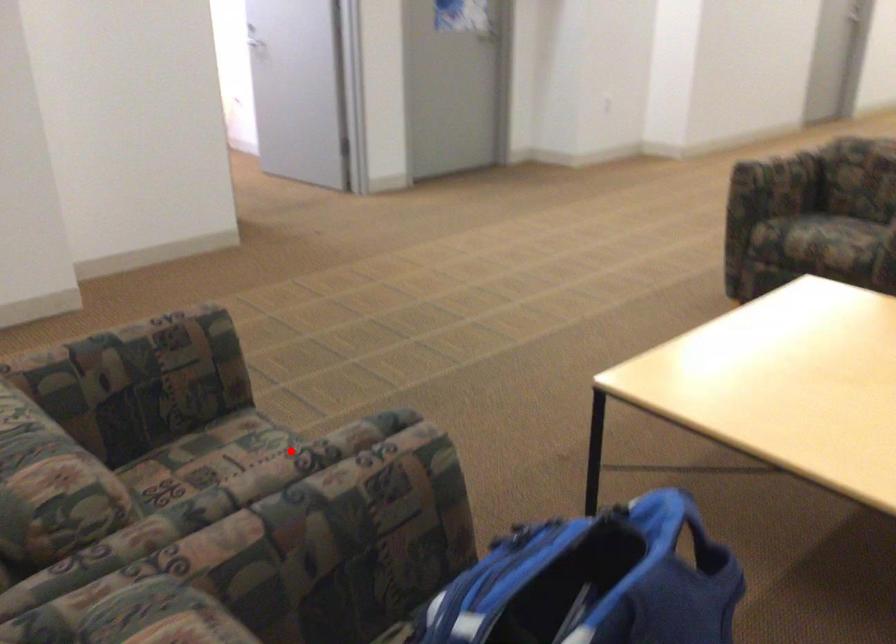
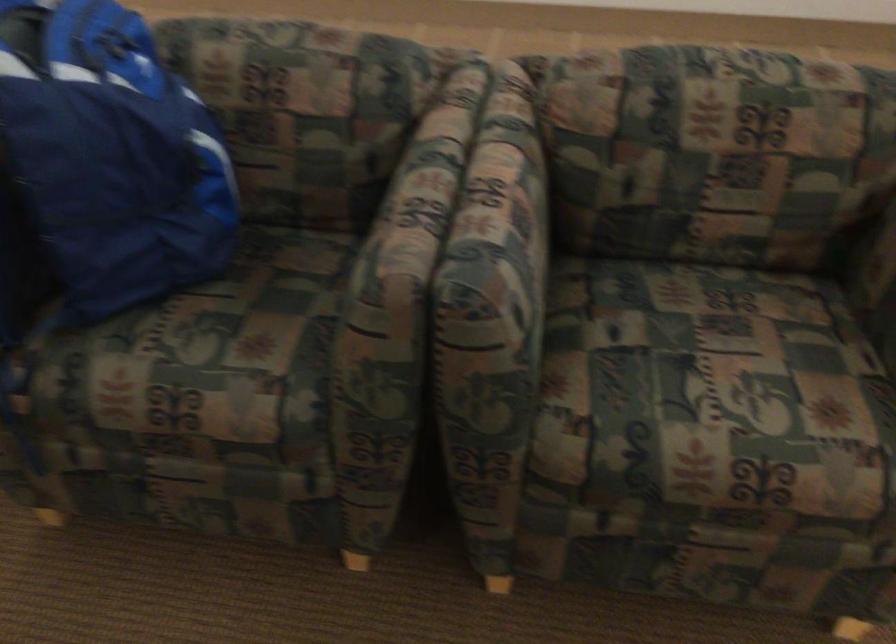
Question: I am providing you with two images of the same scene from different viewpoints. In image1, a red point is highlighted. Considering the same 3D point in image2, which of the following is correct?

Choices:
 (A) It is closer
 (B) It is farther

Answer: (A)